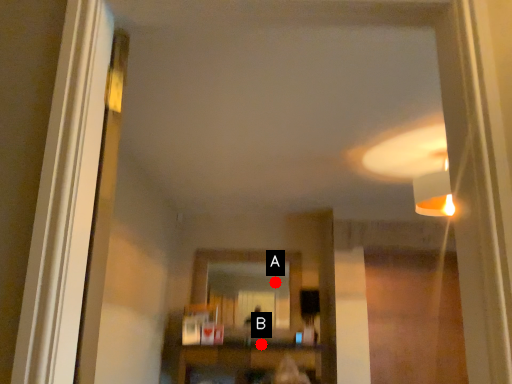
Question: Two points are circled on the image, labeled by A and B beside each circle. Which point is closer to the camera?

Choices:
 (A) A is closer
 (B) B is closer

Answer: (B)